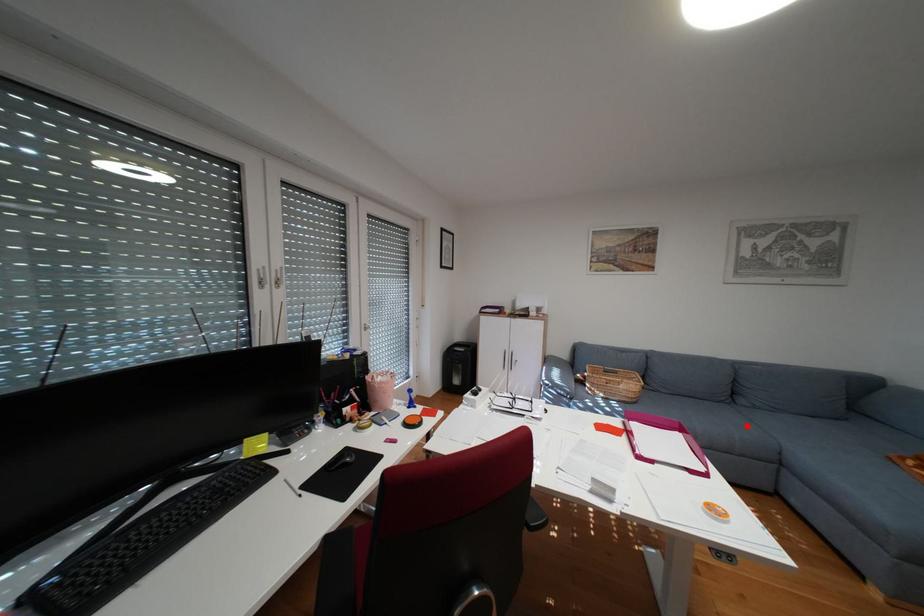
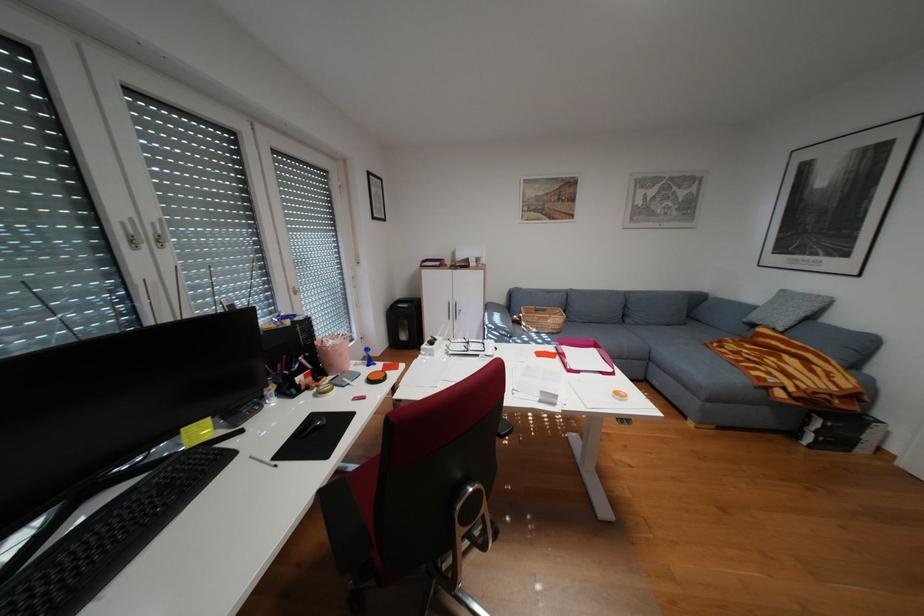
Find the pixel in the second image that matches the highlighted location in the first image.

(638, 339)